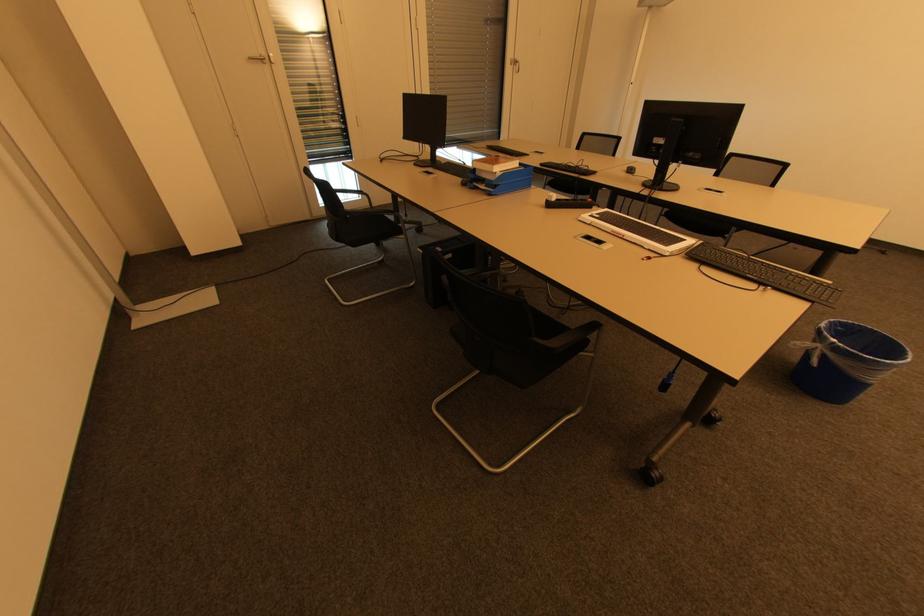
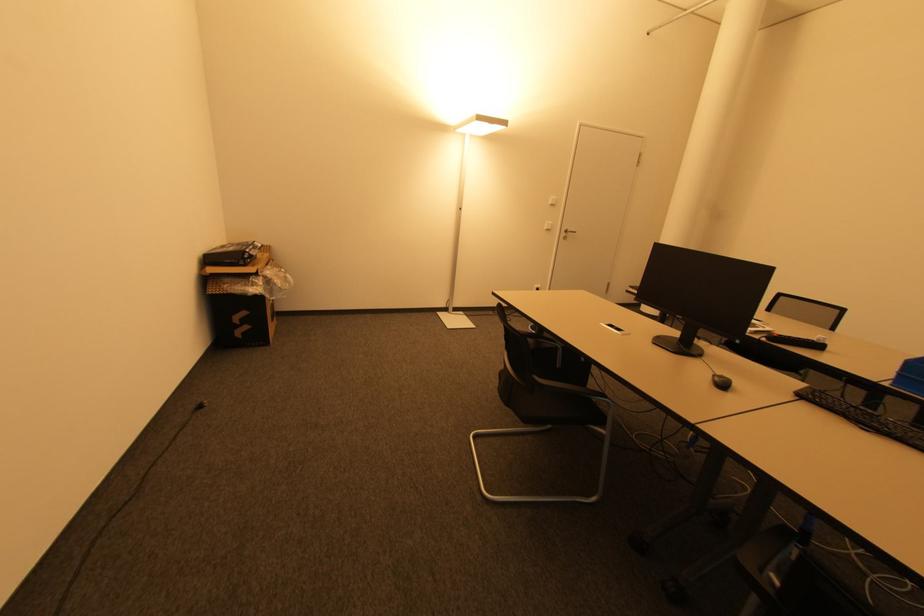
In the second image, find the point that corresponds to point (883, 253) in the first image.

(201, 408)